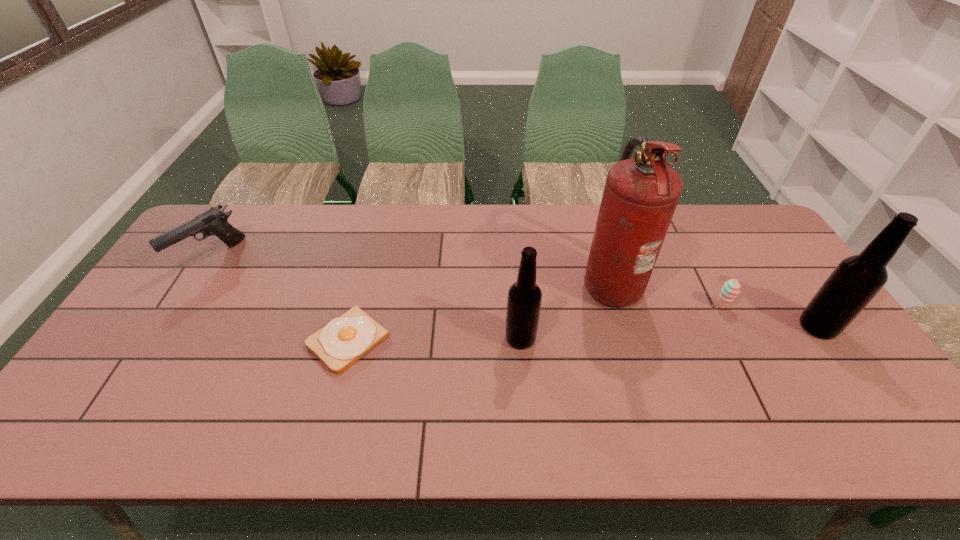
The image size is (960, 540). I want to click on the left beer bottle, so click(524, 299).

Where is `the third object from left to right`? The width and height of the screenshot is (960, 540). the third object from left to right is located at coordinates (524, 299).

Identify the location of the right beer bottle. This screenshot has height=540, width=960. (857, 279).

At what (x,y) coordinates should I click in order to perform the action: click on the taller beer bottle. Please return your answer as a coordinate pair (x, y). The height and width of the screenshot is (540, 960). Looking at the image, I should click on (857, 279).

You are a GUI agent. You are given a task and a screenshot of the screen. Output one action in this format:
    pyautogui.click(x=<x>, y=<y>)
    Task: Click on the leftmost object
    Image resolution: width=960 pixels, height=540 pixels.
    Given the screenshot: What is the action you would take?
    pyautogui.click(x=212, y=222)

Where is `gun`? gun is located at coordinates (212, 222).

The image size is (960, 540). I want to click on the second object from right to left, so click(x=730, y=290).

Identify the location of the second shortest object. This screenshot has width=960, height=540. (730, 290).

The width and height of the screenshot is (960, 540). What are the coordinates of `the fourth object from left to right` in the screenshot? It's located at (640, 196).

You are a GUI agent. You are given a task and a screenshot of the screen. Output one action in this format:
    pyautogui.click(x=<x>, y=<y>)
    Task: Click on the fire extinguisher
    
    Given the screenshot: What is the action you would take?
    pyautogui.click(x=640, y=196)